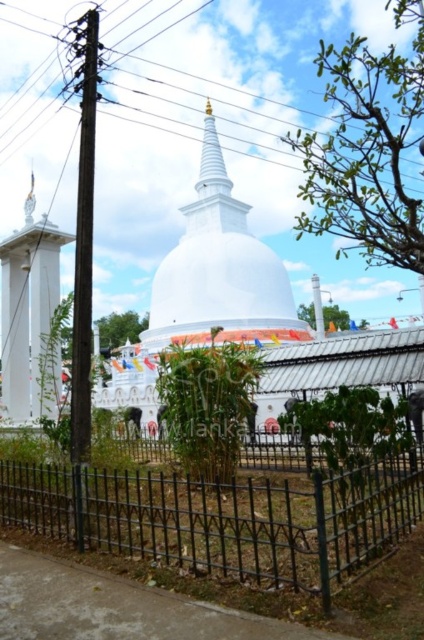
Question: Can you confirm if black plastic power line at upper center is positioned to the left of black wrought iron fence at lower center?

Choices:
 (A) yes
 (B) no

Answer: (B)

Question: Does black plastic power line at upper center lie in front of gold polished stupa at center?

Choices:
 (A) yes
 (B) no

Answer: (A)

Question: Which object is the closest to the black plastic power line at upper center?

Choices:
 (A) black wrought iron fence at lower center
 (B) gold polished stupa at center

Answer: (B)

Question: Which of the following is the farthest from the observer?

Choices:
 (A) (136, 45)
 (B) (223, 166)
 (C) (0, 520)

Answer: (A)

Question: Can you confirm if black plastic power line at upper center is smaller than black wrought iron fence at lower center?

Choices:
 (A) yes
 (B) no

Answer: (B)

Question: Which object is the closest to the black wrought iron fence at lower center?

Choices:
 (A) black plastic power line at upper center
 (B) gold polished stupa at center

Answer: (B)